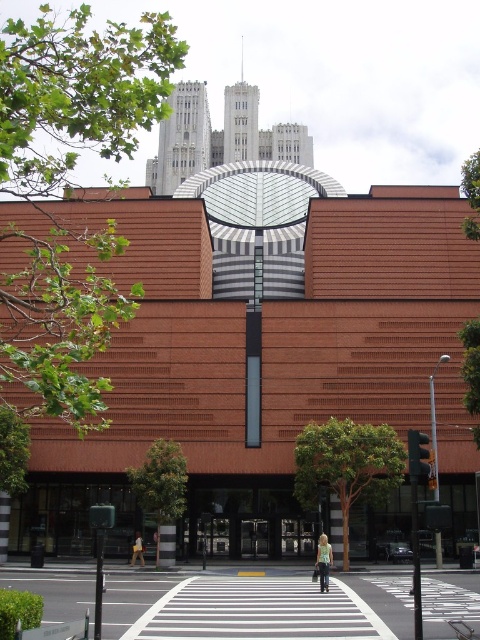
You are a pedestrian standing on the sidewalk and see the denim jacket at center and the light brown leather jacket at center lying on the pedestrian crossing. You want to pick up both jackets before crossing the street. Which jacket should you pick up first to minimize the distance you have to walk?

You should pick up the denim jacket at center first, then the light brown leather jacket at center since they are 10.83 meters apart, so picking the closer one first reduces the total distance walked.

You are standing at the pedestrian crossing and see two points marked on the ground. The first point is labeled as point (319, 548) and the second as point (142, 544). Which point is closer to you when facing the modern building?

Point (319, 548) is closer to you because it is in front of point (142, 544) when facing the modern building.